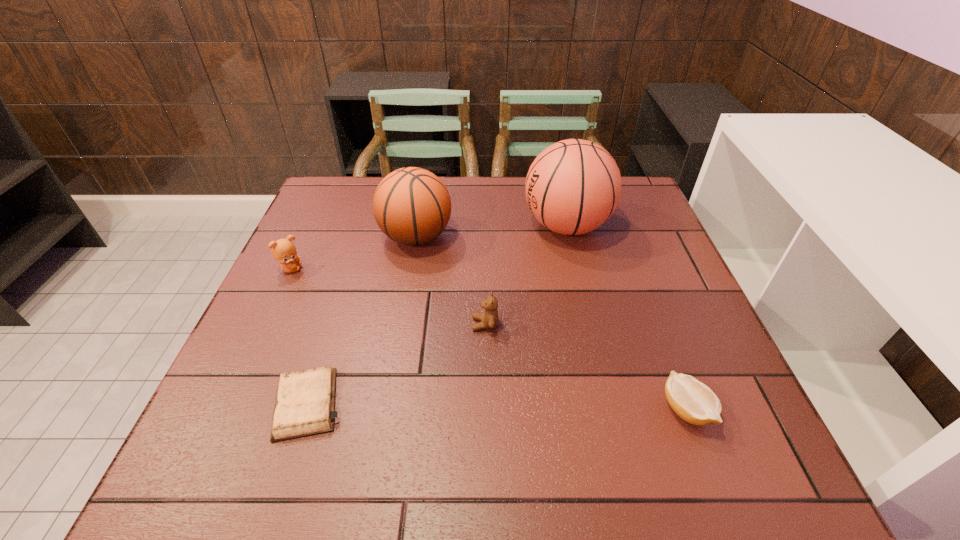
Find the location of `free spot between the right teddy bear and the taller basketball`. free spot between the right teddy bear and the taller basketball is located at coordinates (526, 275).

Identify which object is the fourth closest to the diary. Please provide its 2D coordinates. Your answer should be formatted as a tuple, i.e. [(x, y)], where the tuple contains the x and y coordinates of a point satisfying the conditions above.

[(572, 187)]

In order to click on object that can be found as the closest to the right basketball in this screenshot , I will do `click(412, 206)`.

Where is `free space in the image that satisfies the following two spatial constraints: 1. on the face of the third farthest object; 2. on the right side of the shortest object`? The height and width of the screenshot is (540, 960). free space in the image that satisfies the following two spatial constraints: 1. on the face of the third farthest object; 2. on the right side of the shortest object is located at coordinates (228, 404).

The height and width of the screenshot is (540, 960). What are the coordinates of `free space that satisfies the following two spatial constraints: 1. on the back side of the fifth tallest object; 2. on the face of the left teddy bear` in the screenshot? It's located at click(634, 269).

This screenshot has width=960, height=540. I want to click on free spot that satisfies the following two spatial constraints: 1. on the front side of the fifth shortest object; 2. on the left side of the fifth tallest object, so click(386, 409).

The width and height of the screenshot is (960, 540). Find the location of `free location that satisfies the following two spatial constraints: 1. on the face of the leftmost object; 2. on the back side of the lemon`. free location that satisfies the following two spatial constraints: 1. on the face of the leftmost object; 2. on the back side of the lemon is located at coordinates (225, 409).

Find the location of a particular element. This screenshot has width=960, height=540. vacant space that satisfies the following two spatial constraints: 1. on the face of the diary; 2. on the left side of the fourth nearest object is located at coordinates (228, 404).

At what (x,y) coordinates should I click in order to perform the action: click on vacant space that satisfies the following two spatial constraints: 1. on the back side of the lemon; 2. on the surface of the right basketball near the brand logo. Please return your answer as a coordinate pair (x, y). The width and height of the screenshot is (960, 540). Looking at the image, I should click on (617, 226).